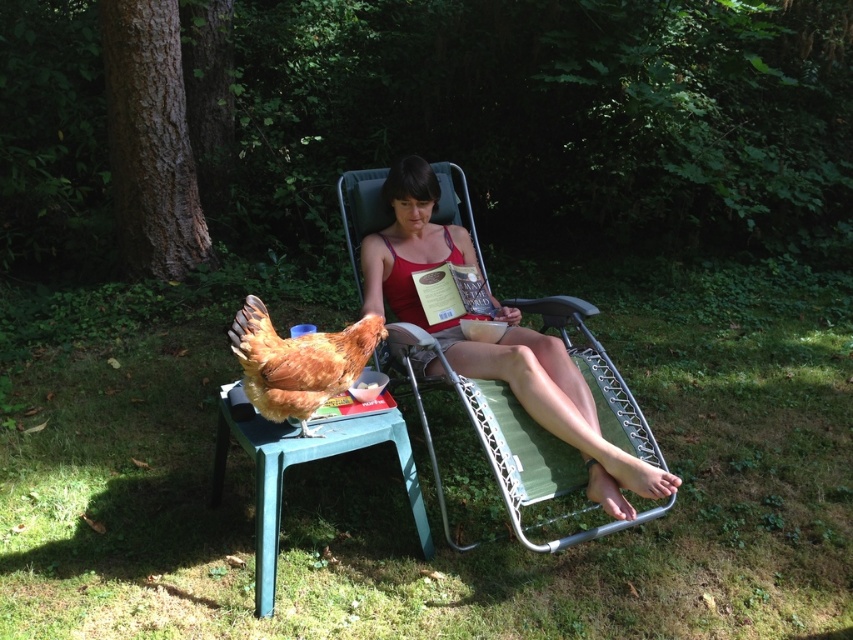
From the picture: You are a photographer trying to capture a candid shot of the person in the matte red tank top at center and the brown feathered chicken at lower left. Your camera has a maximum focus range of 25 inches. Can you fit both subjects in the frame without moving your position?

The matte red tank top at center and brown feathered chicken at lower left are 26.75 inches apart, which exceeds the camera maximum focus range of 25 inches. You will need to move closer to reduce the distance between them in the frame.

You are a photographer trying to capture the person in the red tank top at center. The camera you are using has a focus point at point (498, 340). Will the focus point land on the red tank top at center?

The matte red tank top at center is located at point (498, 340), so yes, the focus point will land on the red tank top at center.